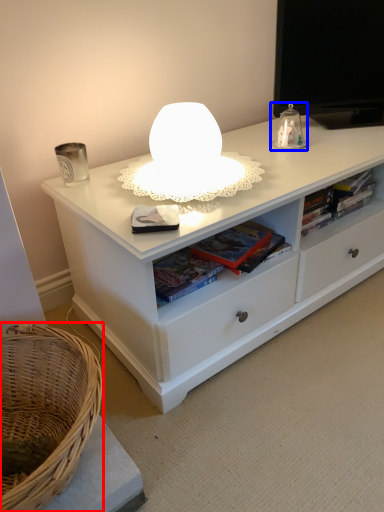
Question: Which object is closer to the camera taking this photo, basket (highlighted by a red box) or table lamp (highlighted by a blue box)?

Choices:
 (A) basket
 (B) table lamp

Answer: (A)